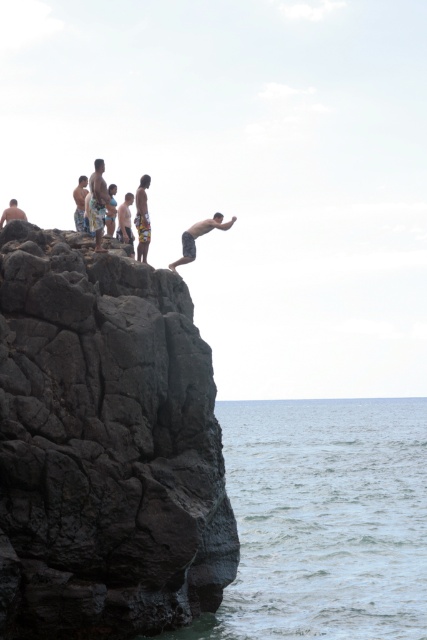
You are standing at point (x=105, y=445) in the image. What is the object located at this point?

The dark gray rocky cliff at upper left is located at point (x=105, y=445).

You are a photographer standing at the edge of the cliff. You want to take a photo of both the yellow patterned shorts at upper center and the matte skin person at upper center in the same frame. Considering their distance apart, can you fit both subjects into your camera viewfinder without zooming in?

The yellow patterned shorts at upper center and the matte skin person at upper center are 8.06 feet apart. Since 8.06 feet is a manageable distance for a standard camera viewfinder, both subjects can be captured in the same frame without zooming in.